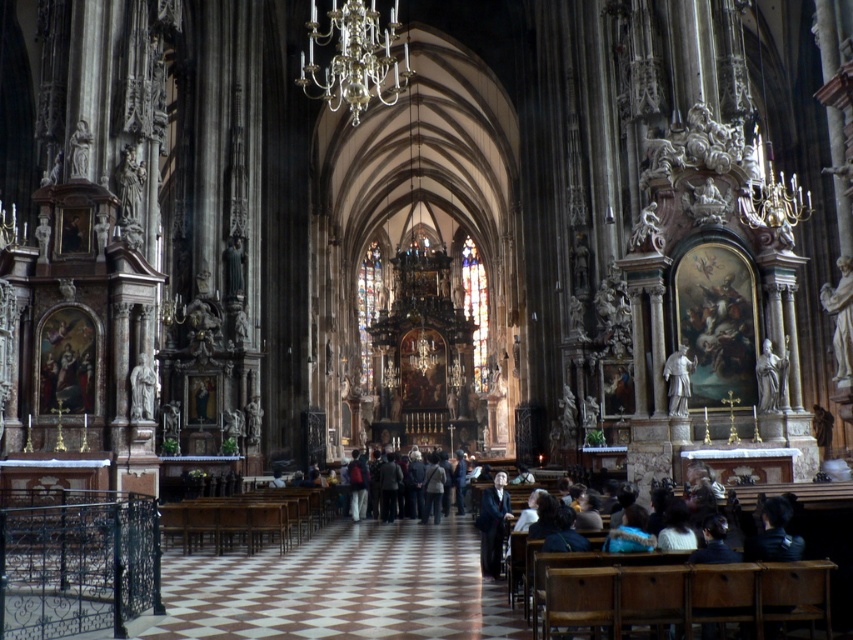
In the scene shown: Is dark suit at center taller than gray stone statue at center?

Yes.

Between point (495, 508) and point (685, 365), which one is positioned in front?

Positioned in front is point (495, 508).

Which is in front, point (492, 515) or point (683, 369)?

Positioned in front is point (492, 515).

Identify the location of dark suit at center. Image resolution: width=853 pixels, height=640 pixels. (492, 524).

Between point (834, 346) and point (496, 524), which one is positioned in front?

Point (834, 346) is in front.

Does white marble statue at right have a greater width compared to dark suit at center?

Indeed, white marble statue at right has a greater width compared to dark suit at center.

Is point (846, 317) behind point (485, 518)?

No.

This screenshot has width=853, height=640. In order to click on white marble statue at right in this screenshot , I will do `click(840, 317)`.

Is point (824, 289) positioned before point (770, 344)?

No, (824, 289) is further to viewer.

Does white marble statue at right appear on the right side of silver statue at right?

Indeed, white marble statue at right is positioned on the right side of silver statue at right.

Does point (842, 291) come closer to viewer compared to point (770, 396)?

Yes, point (842, 291) is closer to viewer.

At what (x,y) coordinates should I click in order to perform the action: click on white marble statue at right. Please return your answer as a coordinate pair (x, y). Looking at the image, I should click on (840, 317).